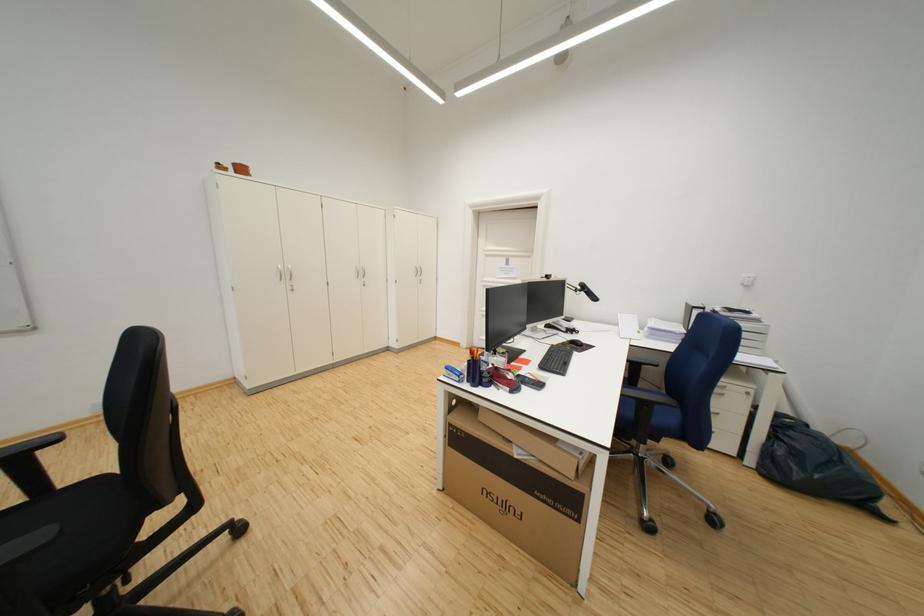
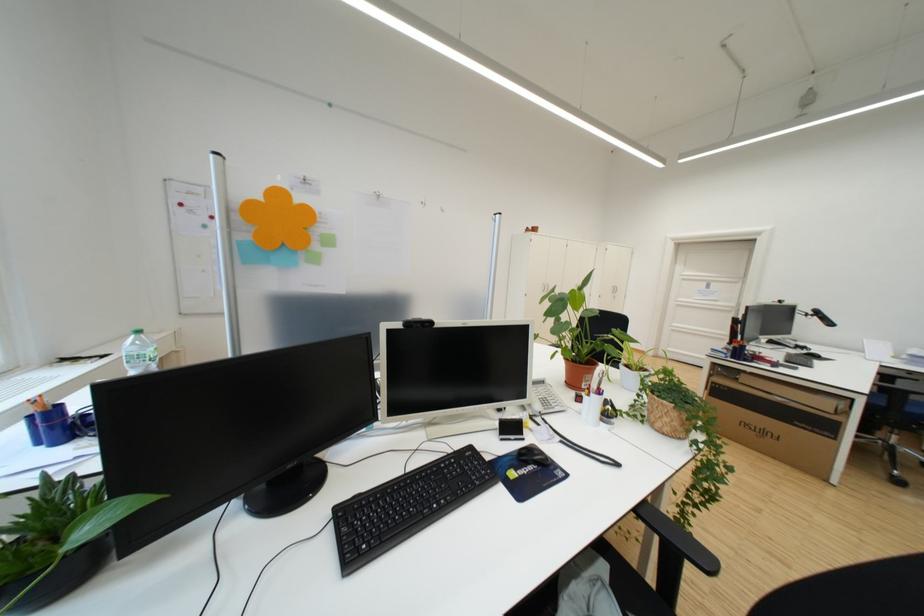
Where in the second image is the point corresponding to point (619, 455) from the first image?

(878, 400)